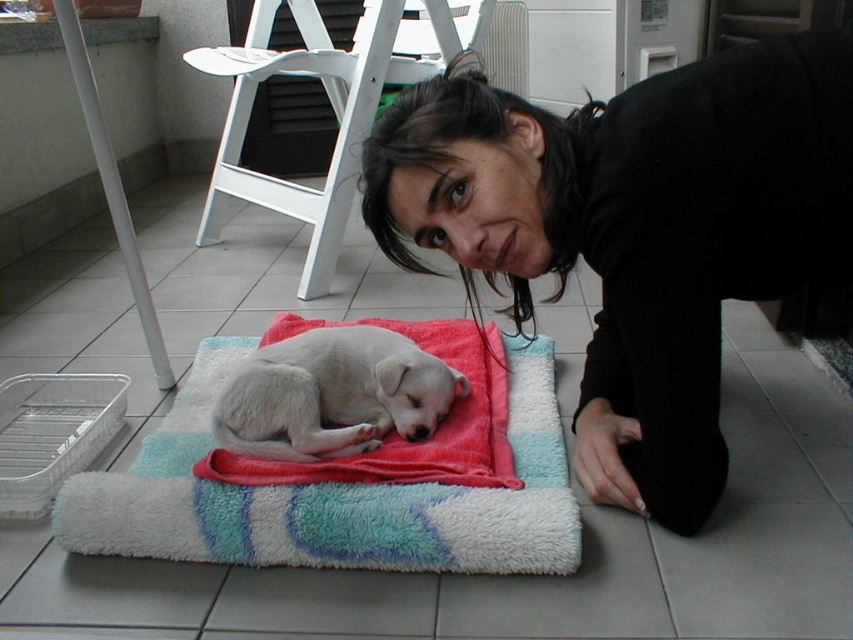
Please describe the position of the black fabric at center in terms of coordinates within the image frame. The image frame has a coordinate system where the origin is at the bottom left corner, with x increasing to the right and y increasing upwards. The coordinates are normalized between 0 and 1. The scene includes a woman, a puppy, and a white folding chair.

The black fabric at center is located at coordinates approximately 0.361 on the x axis and 0.747 on the y axis within the image frame.

You are trying to decide whether to place a new small dog bed on the black fabric at center or the soft multicolored rug at center. Based on their sizes, which surface would be more suitable for the bed?

The black fabric at center is bigger than the soft multicolored rug at center, so the black fabric at center would be more suitable for placing the new small dog bed as it provides more space.